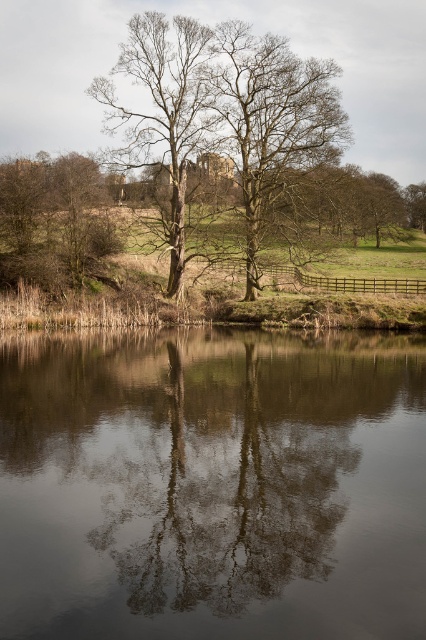
Does smooth reflective water at center have a lesser height compared to bare wood tree at center?

Indeed, smooth reflective water at center has a lesser height compared to bare wood tree at center.

From the picture: Which of these two, smooth reflective water at center or bare wood tree at center, stands shorter?

With less height is smooth reflective water at center.

From the picture: Who is more distant from viewer, (342, 493) or (109, 120)?

Positioned behind is point (109, 120).

Locate an element on the screen. The width and height of the screenshot is (426, 640). smooth reflective water at center is located at coordinates (212, 484).

Can you confirm if smooth reflective water at center is positioned to the right of brown rough bark tree at left?

Indeed, smooth reflective water at center is positioned on the right side of brown rough bark tree at left.

Measure the distance between smooth reflective water at center and brown rough bark tree at left.

29.84 meters

Is point (325, 353) farther from viewer compared to point (11, 196)?

No, it is in front of (11, 196).

You are a GUI agent. You are given a task and a screenshot of the screen. Output one action in this format:
    pyautogui.click(x=<x>, y=<y>)
    Task: Click on the smooth reflective water at center
    The width and height of the screenshot is (426, 640).
    Given the screenshot: What is the action you would take?
    pyautogui.click(x=212, y=484)

Describe the element at coordinates (271, 120) in the screenshot. I see `smooth brown tree at center` at that location.

Between point (235, 81) and point (42, 216), which one is positioned in front?

Positioned in front is point (235, 81).

Which is behind, point (321, 122) or point (80, 170)?

The point (80, 170) is more distant.

What are the coordinates of `smooth brown tree at center` in the screenshot? It's located at (271, 120).